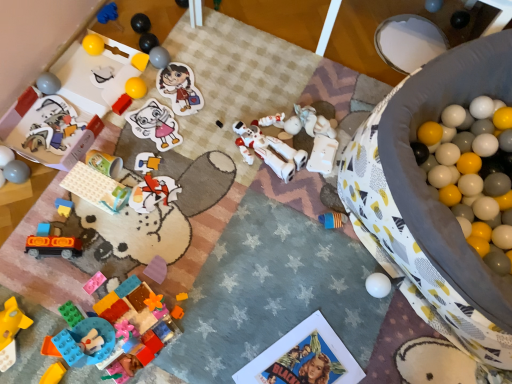
Question: Is translucent plastic toy car at lower left, positioned as the seventh toy in bottom-to-top order, inside the boundaries of rubberized blue and yellow blocks at lower left, which is the 6th toy in bottom-to-top order, or outside?

Choices:
 (A) inside
 (B) outside

Answer: (B)

Question: Is point (114, 208) positioned closer to the camera than point (60, 213)?

Choices:
 (A) farther
 (B) closer

Answer: (A)

Question: Which is nearer to the orange matte car at lower left, the third toy when ordered from bottom to top?

Choices:
 (A) white matte astronaut at center, the eighth toy from the top
 (B) green matte cup at upper left, the 10th toy in the top-to-bottom sequence
 (C) matte white mouse at upper left, which is counted as the 14th toy, starting from the bottom
 (D) orange matte train at lower left, placed as the 5th toy when sorted from bottom to top
 (E) translucent plastic toy car at lower left, positioned as the seventh toy in bottom-to-top order

Answer: (D)

Question: Which is farther from the yellow matte cube at upper left, the fifteenth toy positioned from the bottom?

Choices:
 (A) blue fabric toy at upper left, which appears as the 1th toy when viewed from the top
 (B) matte paper sticker at upper center
 (C) matte plastic toy at upper left, the sixth toy in the top-to-bottom sequence
 (D) white matte astronaut at center, which is the eleventh toy in bottom-to-top order
 (E) shiny metallic ball at upper center, acting as the third toy starting from the top

Answer: (D)